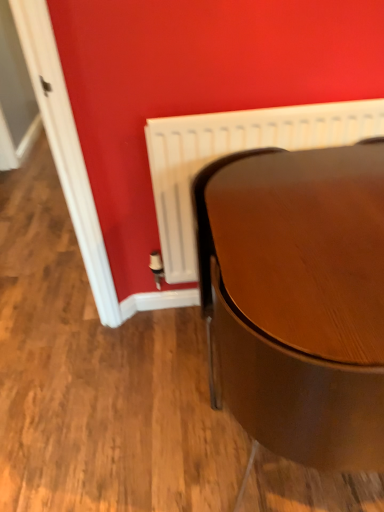
The height and width of the screenshot is (512, 384). Identify the location of vacant area on top of glossy wood table at lower right (from a real-world perspective). (313, 203).